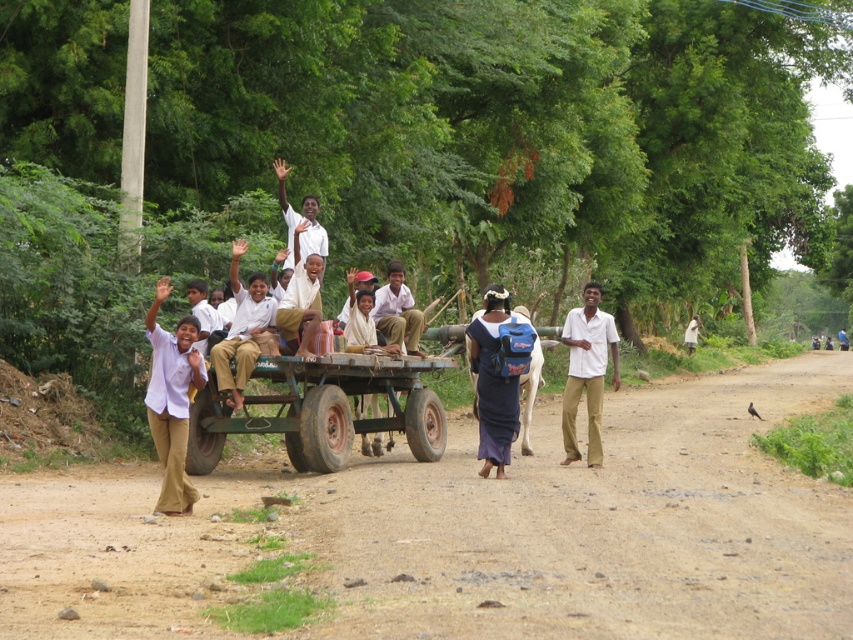
Is blue fabric backpack at center behind light brown fabric dress at center?

No.

Is the position of blue fabric backpack at center less distant than that of light brown fabric dress at center?

Yes, it is in front of light brown fabric dress at center.

Which is in front, point (485, 369) or point (683, 340)?

Point (485, 369)

I want to click on blue fabric backpack at center, so click(x=492, y=381).

Between point (236, 355) and point (402, 307), which one is positioned in front?

Point (236, 355) is in front.

Between point (236, 317) and point (387, 301), which one is positioned behind?

The point (387, 301) is behind.

Describe the element at coordinates (242, 330) in the screenshot. I see `matte white shirt at center` at that location.

The width and height of the screenshot is (853, 640). Identify the location of matte white shirt at center. (242, 330).

Which is behind, point (184, 333) or point (265, 314)?

Positioned behind is point (265, 314).

Is point (157, 440) positioned before point (259, 317)?

Yes, point (157, 440) is in front of point (259, 317).

Locate an element on the screen. matte white shirt at left is located at coordinates (172, 401).